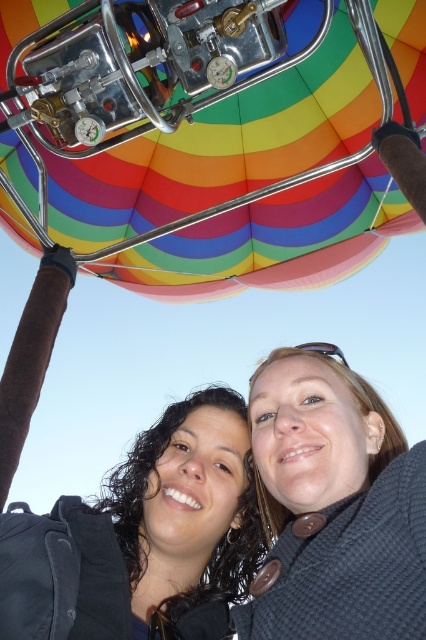
Consider the image. Which is below, rainbow fabric balloon at upper center or smooth skin face at center?

smooth skin face at center is lower down.

Does point (114, 170) come farther from viewer compared to point (94, 522)?

Yes, point (114, 170) is farther from viewer.

You are a GUI agent. You are given a task and a screenshot of the screen. Output one action in this format:
    pyautogui.click(x=<x>, y=<y>)
    Task: Click on the rainbow fabric balloon at upper center
    This screenshot has height=640, width=426.
    Given the screenshot: What is the action you would take?
    pyautogui.click(x=218, y=148)